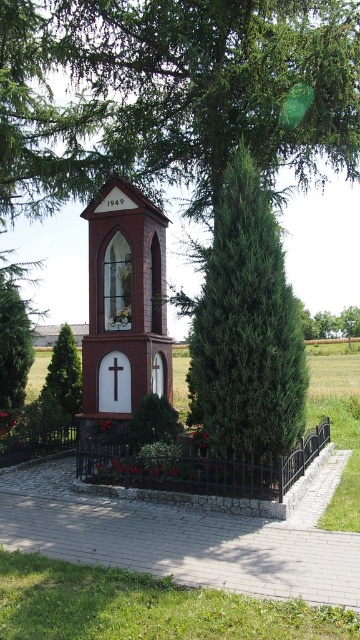
Is black metal fence at lower left further to camera compared to white matte cross at center?

No.

Can you confirm if black metal fence at lower left is bigger than white matte cross at center?

Yes.

Is point (33, 436) positioned in front of point (115, 397)?

Yes, point (33, 436) is in front of point (115, 397).

At what (x,y) coordinates should I click in order to perform the action: click on black metal fence at lower left. Please return your answer as a coordinate pair (x, y). Looking at the image, I should click on (36, 444).

Does green textured tree at center appear on the right side of green textured tree at left?

Indeed, green textured tree at center is positioned on the right side of green textured tree at left.

Is green textured tree at center bigger than green textured tree at left?

Indeed, green textured tree at center has a larger size compared to green textured tree at left.

Identify the location of green textured tree at center. (246, 332).

Who is positioned more to the left, green textured tree at left or green leafy tree at lower left?

green textured tree at left is more to the left.

Is green textured tree at left closer to camera compared to green leafy tree at lower left?

No, green textured tree at left is behind green leafy tree at lower left.

What do you see at coordinates (14, 346) in the screenshot? I see `green textured tree at left` at bounding box center [14, 346].

Image resolution: width=360 pixels, height=640 pixels. What are the coordinates of `green textured tree at left` in the screenshot? It's located at (14, 346).